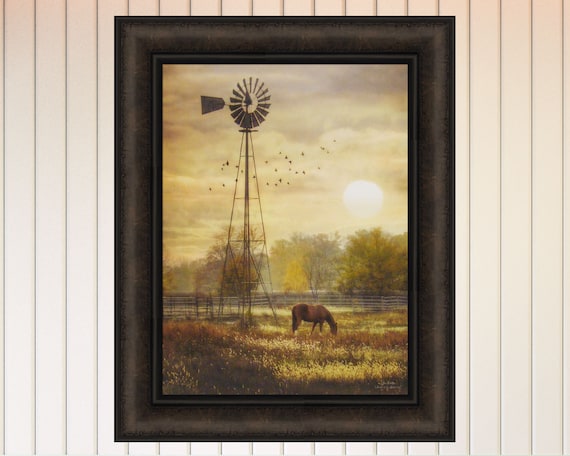
Locate an element on the screen. Image resolution: width=570 pixels, height=456 pixels. painting is located at coordinates coord(235,317).